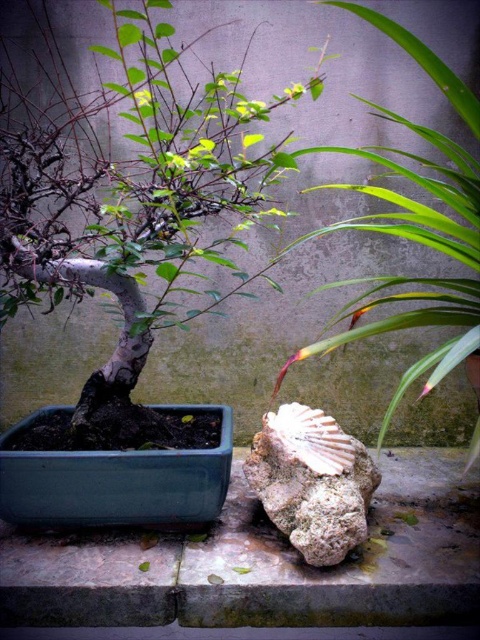
Question: Can you confirm if matte gray bonsai at left is bigger than rough textured stone at center?

Choices:
 (A) yes
 (B) no

Answer: (A)

Question: Which object appears farthest from the camera in this image?

Choices:
 (A) matte gray bonsai at left
 (B) green leafy plant at center
 (C) rough textured stone at center

Answer: (C)

Question: Can you confirm if matte gray bonsai at left is positioned above green leafy plant at center?

Choices:
 (A) yes
 (B) no

Answer: (A)

Question: Is the position of matte gray bonsai at left less distant than that of rough textured stone at center?

Choices:
 (A) yes
 (B) no

Answer: (A)

Question: Which point is closer to the camera?

Choices:
 (A) (465, 280)
 (B) (269, 500)
 (C) (106, 52)

Answer: (C)

Question: Among these objects, which one is nearest to the camera?

Choices:
 (A) rough textured stone at center
 (B) matte gray bonsai at left

Answer: (B)